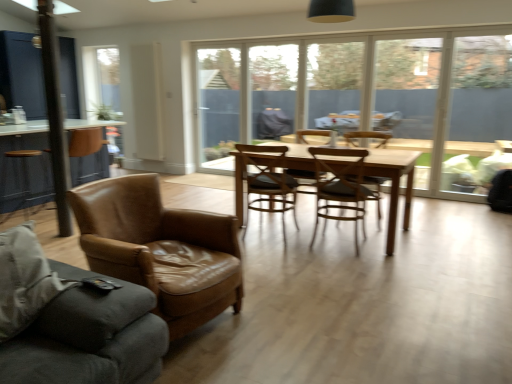
You are a GUI agent. You are given a task and a screenshot of the screen. Output one action in this format:
    pyautogui.click(x=<x>, y=<y>)
    Task: Click on the free space in front of light brown wooden table at center
    
    Given the screenshot: What is the action you would take?
    pyautogui.click(x=361, y=279)